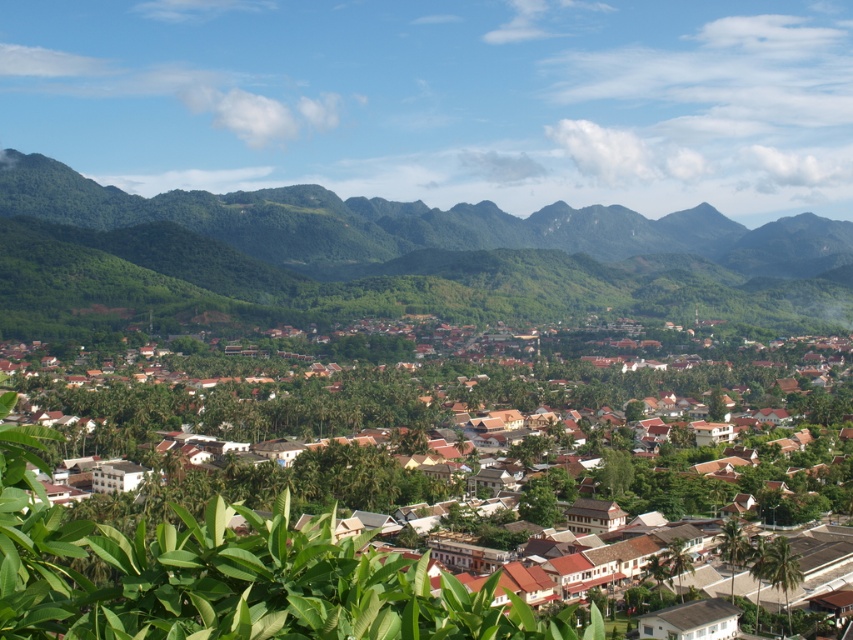
You are standing in the lush landscape and want to take a photo of both the green forested mountain at upper center and the brown wooden houses at center. Which object should you focus on first to ensure both are in sharp focus?

You should focus on the brown wooden houses at center first because they are closer to you than the green forested mountain at upper center, which is further away. This way, both will be in focus as the mountain is behind the houses.

You are standing in the lush landscape and want to take a photo of both the green forested mountain at upper center and the brown wooden houses at center. Which object should you point your camera towards first to ensure both are in the frame?

You should point your camera towards the green forested mountain at upper center first since it is above the brown wooden houses at center, so adjusting the frame to include the upper part will naturally include the lower area where the brown wooden houses at center are located.

In the scene shown: You are planning to build a new communication tower in the town. Considering the green forested mountain at upper center and the brown wooden houses at center, which location would provide better visibility for the tower?

The green forested mountain at upper center is much taller than the brown wooden houses at center, so building the tower on the green forested mountain at upper center would provide better visibility.